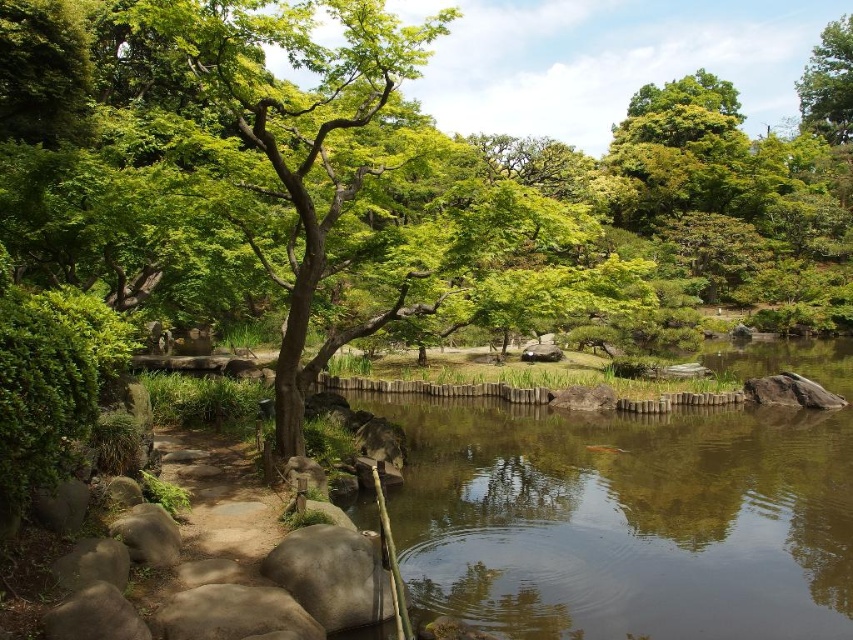
Question: Which point is closer to the camera?

Choices:
 (A) (831, 632)
 (B) (805, 122)

Answer: (A)

Question: Which of the following is the closest to the observer?

Choices:
 (A) green leafy tree at upper right
 (B) smooth brown water at center

Answer: (B)

Question: Which point is closer to the camera?

Choices:
 (A) smooth brown water at center
 (B) green leafy tree at upper right

Answer: (A)

Question: Is smooth brown water at center to the right of green leafy tree at upper right from the viewer's perspective?

Choices:
 (A) no
 (B) yes

Answer: (A)

Question: Is smooth brown water at center closer to camera compared to green leafy tree at upper right?

Choices:
 (A) no
 (B) yes

Answer: (B)

Question: Does smooth brown water at center lie in front of green leafy tree at upper right?

Choices:
 (A) yes
 (B) no

Answer: (A)